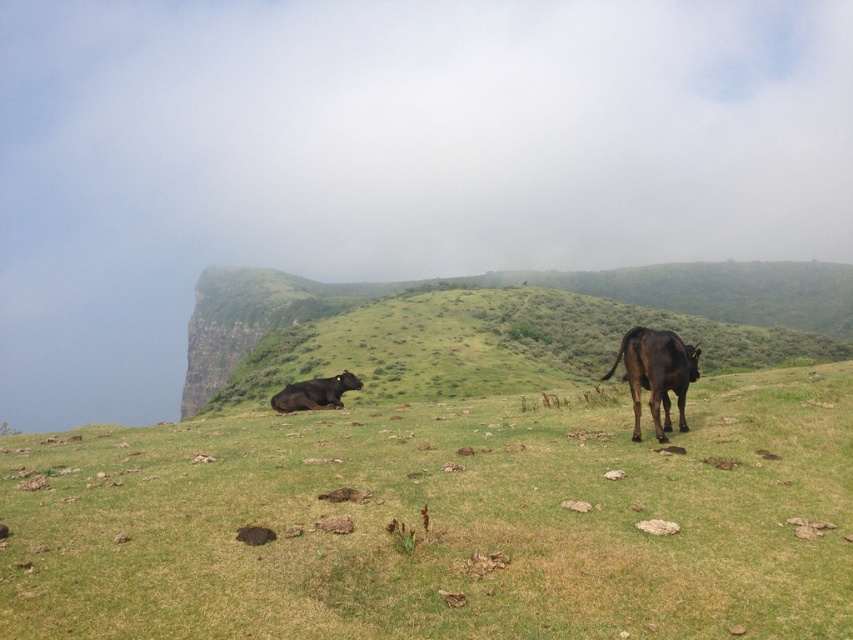
Can you confirm if green grassy hillside at center is bigger than shiny brown bull at right?

Indeed, green grassy hillside at center has a larger size compared to shiny brown bull at right.

Based on the photo, who is higher up, green grassy hillside at center or shiny brown bull at right?

green grassy hillside at center is higher up.

Locate an element on the screen. The height and width of the screenshot is (640, 853). green grassy hillside at center is located at coordinates (514, 284).

The image size is (853, 640). What are the coordinates of `green grassy hillside at center` in the screenshot? It's located at (514, 284).

Is green grassy at center wider than shiny brown bull at right?

Indeed, green grassy at center has a greater width compared to shiny brown bull at right.

Who is shorter, green grassy at center or shiny brown bull at right?

With less height is green grassy at center.

Which is in front, point (86, 488) or point (647, 340)?

Positioned in front is point (86, 488).

At what (x,y) coordinates should I click in order to perform the action: click on green grassy at center. Please return your answer as a coordinate pair (x, y). Looking at the image, I should click on (444, 520).

Can you confirm if green grassy at center is shorter than shiny black cow at center?

No.

Is green grassy at center smaller than shiny black cow at center?

Incorrect, green grassy at center is not smaller in size than shiny black cow at center.

Between point (608, 515) and point (306, 408), which one is positioned behind?

The point (306, 408) is more distant.

Find the location of `green grassy at center`. green grassy at center is located at coordinates (444, 520).